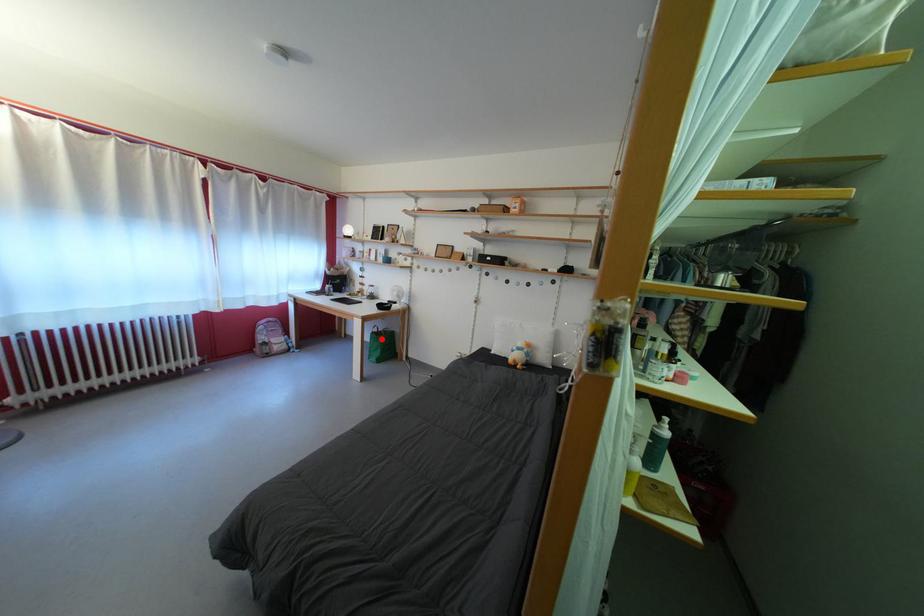
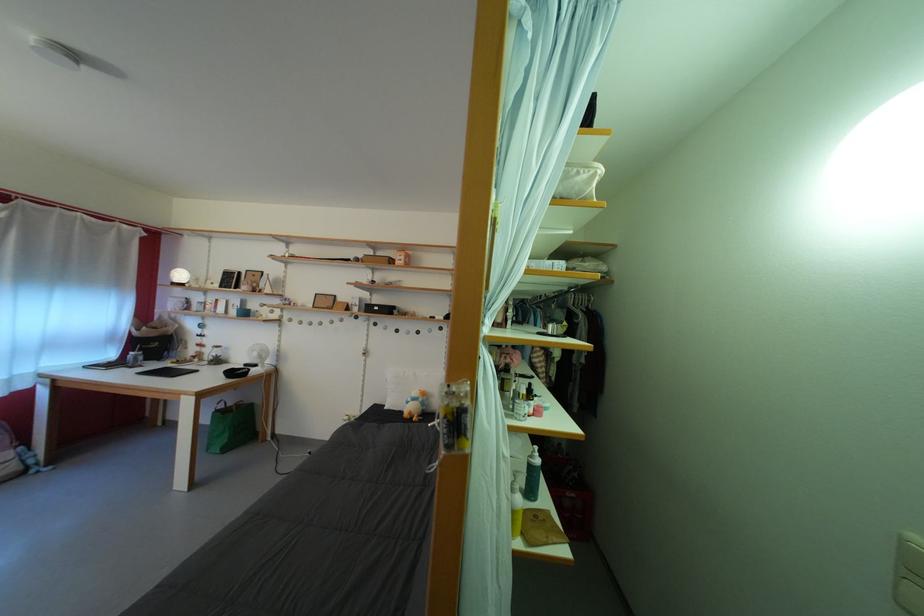
Question: I am providing you with two images of the same scene from different viewpoints. Given a red point in image1, look at the same physical point in image2. Is it:

Choices:
 (A) Closer to the viewpoint
 (B) Farther from the viewpoint

Answer: (A)